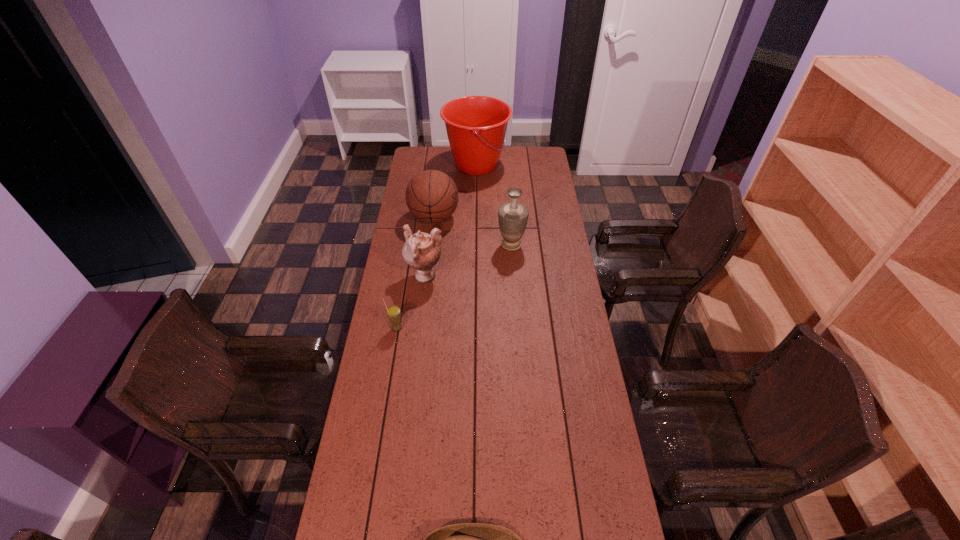
Locate an element on the screen. vacant space located on the right of the left urn is located at coordinates (515, 277).

Where is `blank space located on the side with brand label of the second farthest object`? Image resolution: width=960 pixels, height=540 pixels. blank space located on the side with brand label of the second farthest object is located at coordinates (482, 218).

I want to click on blank space located 0.220m on the right of the fifth farthest object, so click(462, 328).

Image resolution: width=960 pixels, height=540 pixels. What are the coordinates of `object that is at the far edge` in the screenshot? It's located at coord(476,126).

Locate an element on the screen. This screenshot has width=960, height=540. urn that is at the left edge is located at coordinates click(421, 251).

Where is `basketball that is at the left edge`? This screenshot has height=540, width=960. basketball that is at the left edge is located at coordinates tap(431, 196).

The image size is (960, 540). I want to click on straw for drinking that is at the left edge, so (x=393, y=312).

Identify the location of vacant space at the left edge. The image size is (960, 540). pyautogui.click(x=401, y=244).

Where is `free spot at the right edge of the desktop`? Image resolution: width=960 pixels, height=540 pixels. free spot at the right edge of the desktop is located at coordinates click(529, 176).

Where is `vacant area at the far left corner of the desktop`? The width and height of the screenshot is (960, 540). vacant area at the far left corner of the desktop is located at coordinates (416, 148).